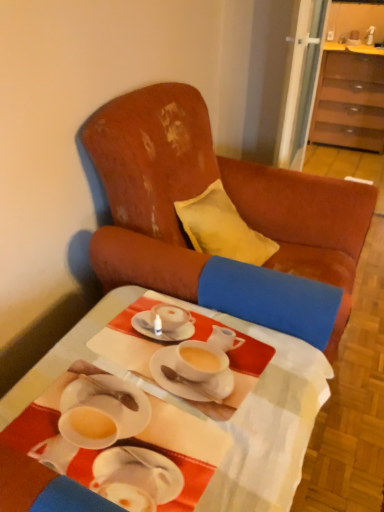
Image resolution: width=384 pixels, height=512 pixels. In order to click on vacant space situated above white glossy table at center (from a real-world perspective) in this screenshot , I will do `click(184, 387)`.